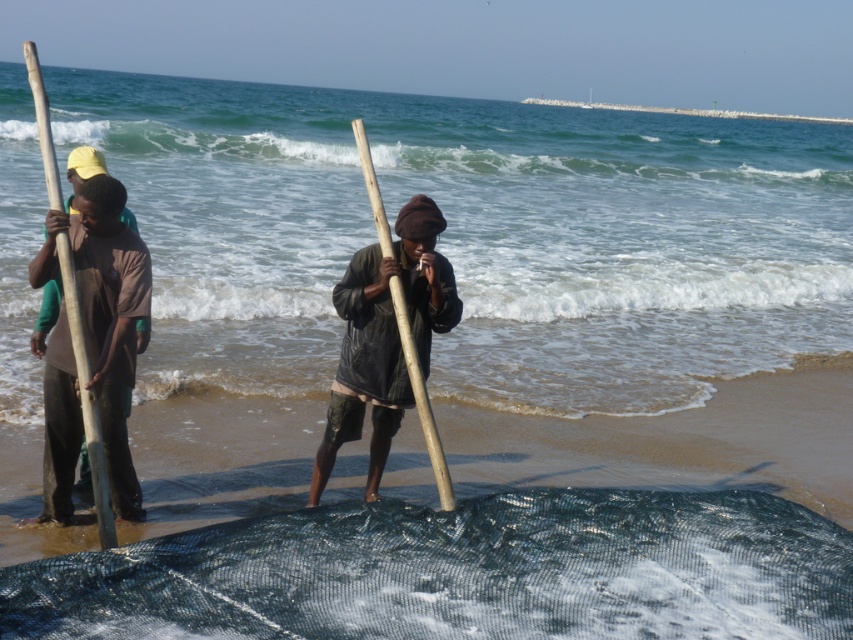
Which is in front, point (576, 113) or point (83, 380)?

Point (83, 380) is in front.

How far apart are clear blue water at center and wooden paddle at left?

clear blue water at center and wooden paddle at left are 67.46 feet apart.

Image resolution: width=853 pixels, height=640 pixels. What do you see at coordinates (474, 237) in the screenshot?
I see `clear blue water at center` at bounding box center [474, 237].

You are a GUI agent. You are given a task and a screenshot of the screen. Output one action in this format:
    pyautogui.click(x=<x>, y=<y>)
    Task: Click on the clear blue water at center
    This screenshot has width=853, height=640.
    Given the screenshot: What is the action you would take?
    pyautogui.click(x=474, y=237)

Is point (397, 592) positioned after point (44, 129)?

No, (397, 592) is closer to viewer.

Who is shorter, black mesh net at lower center or wooden paddle at left?

With less height is black mesh net at lower center.

Which is in front, point (416, 627) or point (93, 422)?

Point (416, 627) is in front.

This screenshot has width=853, height=640. I want to click on black mesh net at lower center, so click(x=461, y=572).

Can you confirm if clear blue water at center is thinner than black mesh net at lower center?

Incorrect, clear blue water at center's width is not less than black mesh net at lower center's.

The image size is (853, 640). What are the coordinates of `clear blue water at center` in the screenshot? It's located at (474, 237).

Is point (135, 161) positioned behind point (341, 566)?

Yes, it is behind point (341, 566).

Locate an element on the screen. clear blue water at center is located at coordinates (474, 237).